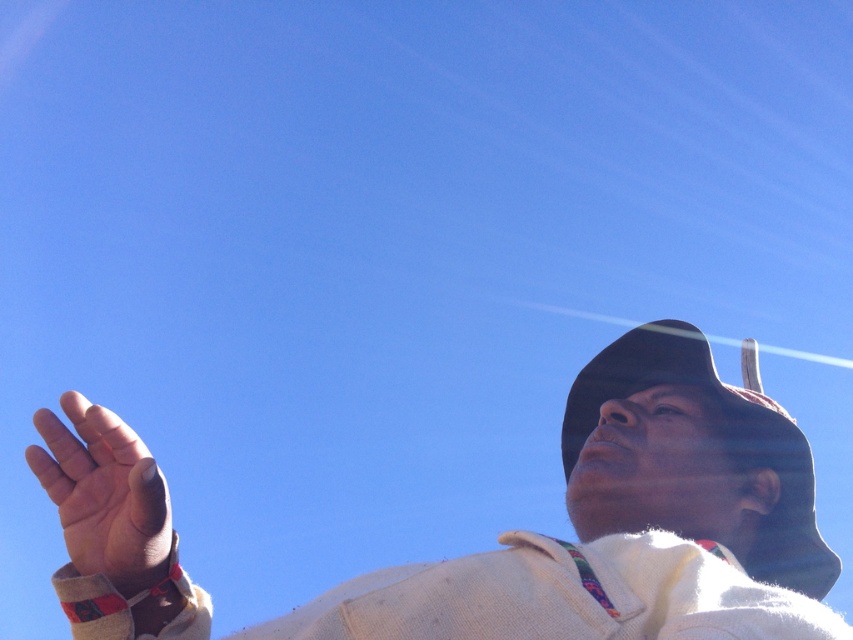
Which is more to the left, white knitted sweater at upper right or smooth skin hand at lower left?

smooth skin hand at lower left

Is white knitted sweater at upper right to the left of smooth skin hand at lower left from the viewer's perspective?

Incorrect, white knitted sweater at upper right is not on the left side of smooth skin hand at lower left.

Which is in front, point (749, 579) or point (53, 440)?

Point (53, 440) is more forward.

The image size is (853, 640). What are the coordinates of `white knitted sweater at upper right` in the screenshot? It's located at (630, 525).

Is point (788, 616) positioned in front of point (628, 372)?

Yes, point (788, 616) is in front of point (628, 372).

Between white knitted sweater at upper right and brown felt cowboy hat at right, which one appears on the left side from the viewer's perspective?

white knitted sweater at upper right is more to the left.

Is point (611, 468) less distant than point (813, 500)?

Yes.

Find the location of a particular element. white knitted sweater at upper right is located at coordinates (630, 525).

Does brown felt cowboy hat at right have a greater height compared to smooth skin hand at lower left?

Indeed, brown felt cowboy hat at right has a greater height compared to smooth skin hand at lower left.

What do you see at coordinates (724, 445) in the screenshot?
I see `brown felt cowboy hat at right` at bounding box center [724, 445].

The height and width of the screenshot is (640, 853). In order to click on brown felt cowboy hat at right in this screenshot , I will do `click(724, 445)`.